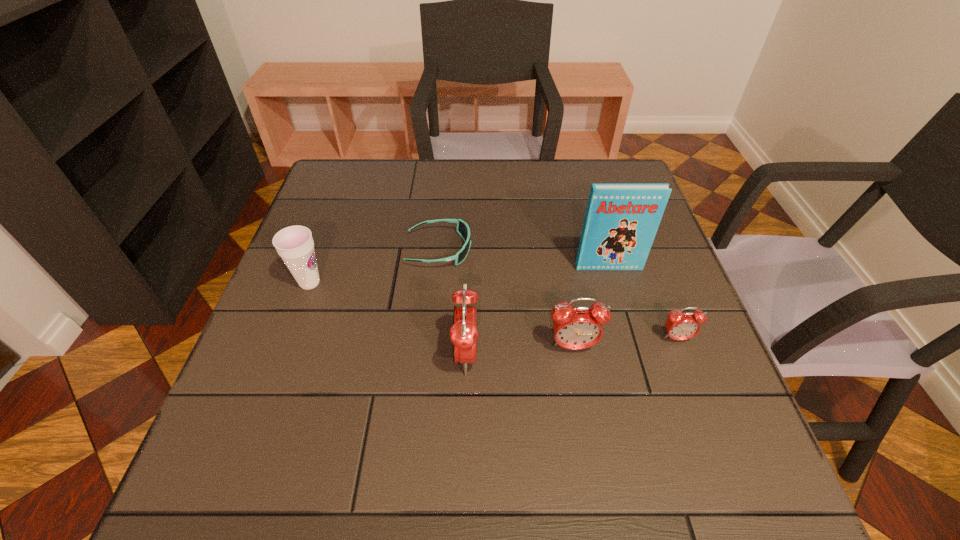
I want to click on object that is the fourth closest to the shortest object, so click(621, 221).

Identify which object is located as the fifth nearest to the leftmost object. Please provide its 2D coordinates. Your answer should be formatted as a tuple, i.e. [(x, y)], where the tuple contains the x and y coordinates of a point satisfying the conditions above.

[(680, 326)]

This screenshot has width=960, height=540. I want to click on alarm clock that is the closest to the leftmost alarm clock, so click(x=575, y=328).

Identify the location of the second closest alarm clock to the shortest object. (575, 328).

Locate an element on the screen. Image resolution: width=960 pixels, height=540 pixels. free space that satisfies the following two spatial constraints: 1. on the front cover of the tallest object; 2. on the face of the leftmost alarm clock is located at coordinates (634, 355).

Find the location of `vacant region that satisfies the following two spatial constraints: 1. on the front cover of the book; 2. on the face of the leftmost alarm clock`. vacant region that satisfies the following two spatial constraints: 1. on the front cover of the book; 2. on the face of the leftmost alarm clock is located at coordinates (634, 355).

Find the location of `vacant space that satisfies the following two spatial constraints: 1. on the face of the rightmost alarm clock; 2. on the face of the leftmost alarm clock`. vacant space that satisfies the following two spatial constraints: 1. on the face of the rightmost alarm clock; 2. on the face of the leftmost alarm clock is located at coordinates (683, 355).